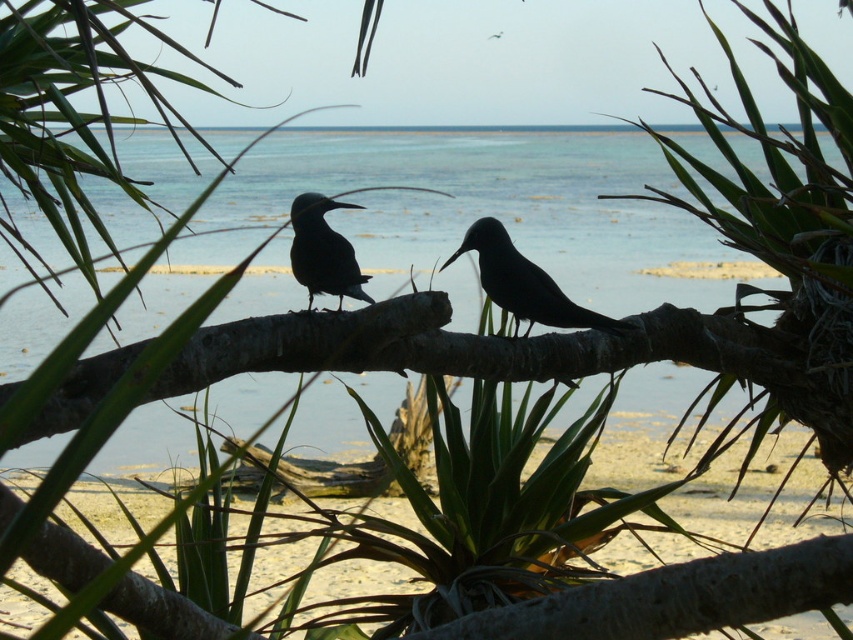
Is point (514, 276) behind point (309, 246)?

Yes, it is.

Is the position of black glossy bird at center more distant than that of shiny black bird at center?

Yes.

From the picture: Who is more distant from viewer, [482,228] or [329,246]?

The point [482,228] is more distant.

Locate an element on the screen. The image size is (853, 640). black glossy bird at center is located at coordinates (524, 284).

Which is more to the right, clear blue water at center or sandy beach at lower center?

sandy beach at lower center

Is clear blue water at center bigger than sandy beach at lower center?

Yes, clear blue water at center is bigger than sandy beach at lower center.

Measure the distance between point (645, 253) and camera.

Point (645, 253) is 22.87 feet from camera.

Image resolution: width=853 pixels, height=640 pixels. Find the location of `clear blue water at center`. clear blue water at center is located at coordinates (492, 205).

Between clear blue water at center and shiny black bird at center, which one has more height?

With more height is clear blue water at center.

Who is more distant from viewer, (540, 228) or (300, 257)?

Positioned behind is point (540, 228).

The image size is (853, 640). Identify the location of clear blue water at center. (492, 205).